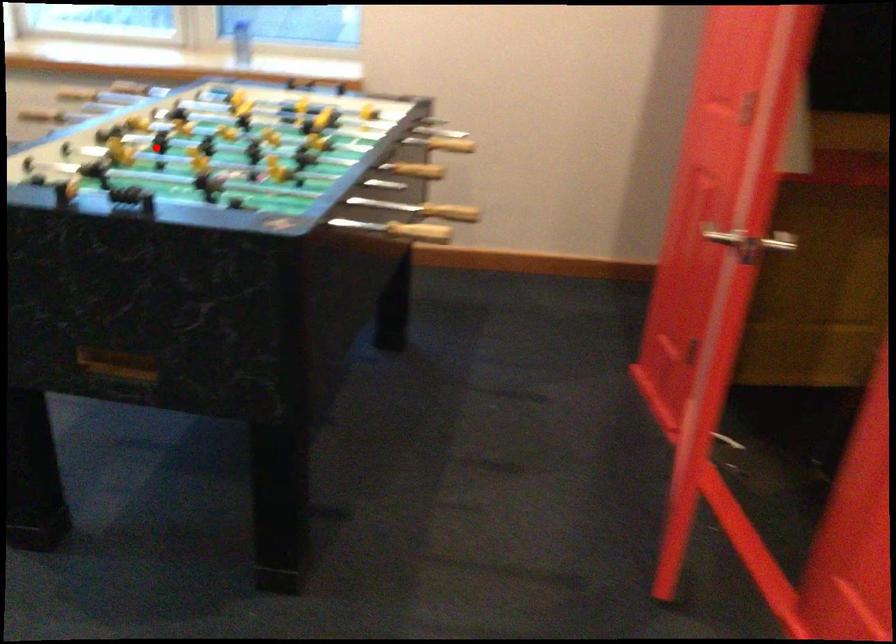
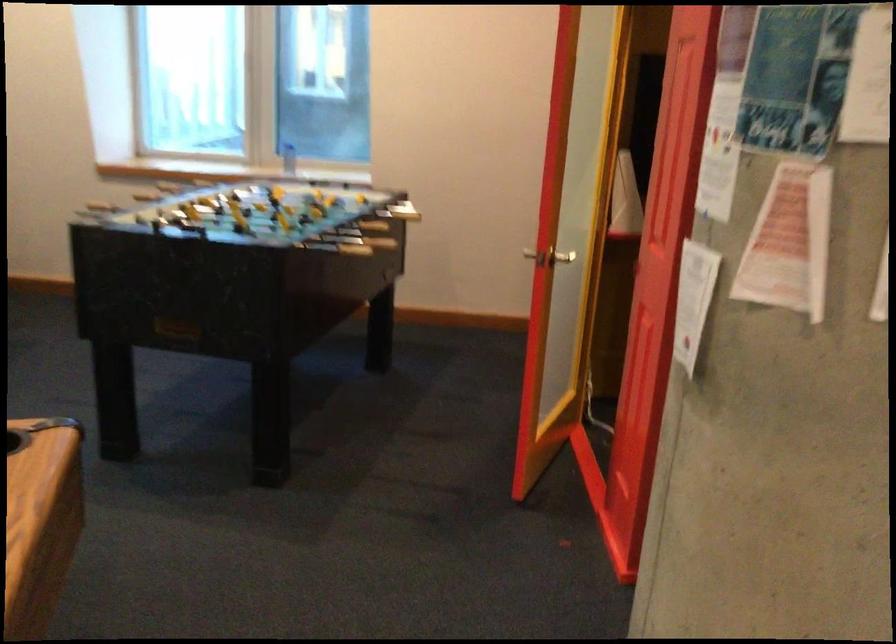
The point at the highlighted location is marked in the first image. Where is the corresponding point in the second image?

(213, 210)